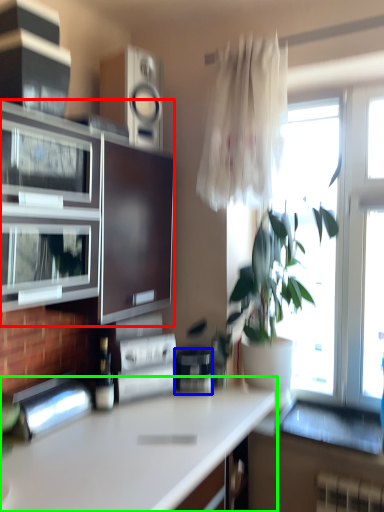
Question: Which object is positioned farthest from cabinetry (highlighted by a red box)? Select from appliance (highlighted by a blue box) and countertop (highlighted by a green box).

Choices:
 (A) appliance
 (B) countertop

Answer: (A)